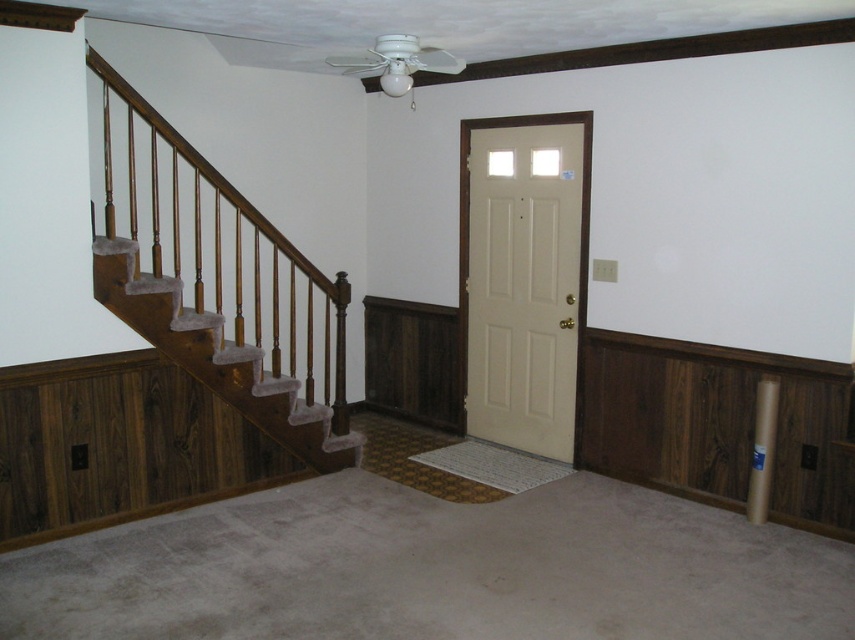
Between wooden stair railing at left and beige matte door at center, which one is positioned higher?

wooden stair railing at left

Is point (310, 404) farther from camera compared to point (498, 356)?

No, (310, 404) is in front of (498, 356).

What are the coordinates of `wooden stair railing at left` in the screenshot? It's located at (221, 294).